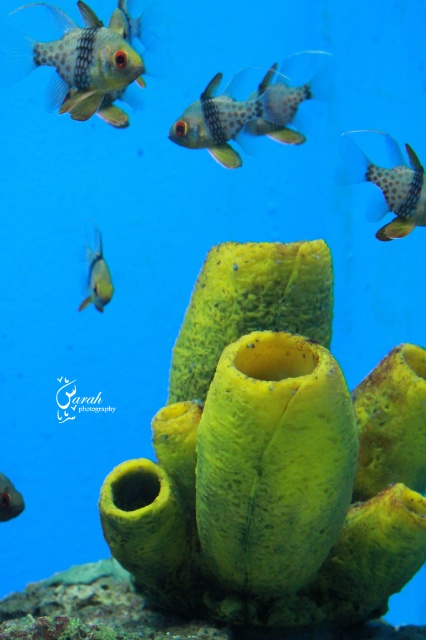
In the scene shown: You are an underwater photographer trying to capture a closeup of the polka dot fabric fish at upper left and the shiny silver fish at lower left. Given that your camera lens can only focus on objects up to 15 cm wide, will both fish fit within the frame if you position the camera to include both?

The polka dot fabric fish at upper left is larger in width than the shiny silver fish at lower left. However, without knowing the exact width of the polka dot fabric fish at upper left, it is impossible to determine if both will fit within the 15 cm frame. Please measure the width of the polka dot fabric fish at upper left first.

In the scene shown: You are an underwater photographer aiming to capture both the translucent yellow fish at lower left and the shiny silver fish at lower left in a single frame. Given their sizes, which fish would require more space in the photo to avoid cropping?

The translucent yellow fish at lower left requires more space in the photo because its width surpasses that of the shiny silver fish at lower left.

You are an underwater photographer aiming to capture both the polka dot fabric fish at upper left and the speckled plastic fish at center in a single frame. Given their sizes, which fish should you focus on to ensure both fit clearly in the photo?

The polka dot fabric fish at upper left is larger than the speckled plastic fish at center. To ensure both fit clearly in the photo, focus on the larger polka dot fabric fish at upper left and adjust the camera angle to include the smaller speckled plastic fish at center within the frame.